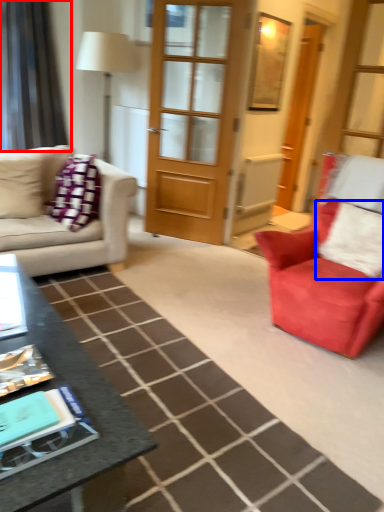
Question: Which point is further to the camera, curtain (highlighted by a red box) or pillow (highlighted by a blue box)?

Choices:
 (A) curtain
 (B) pillow

Answer: (A)